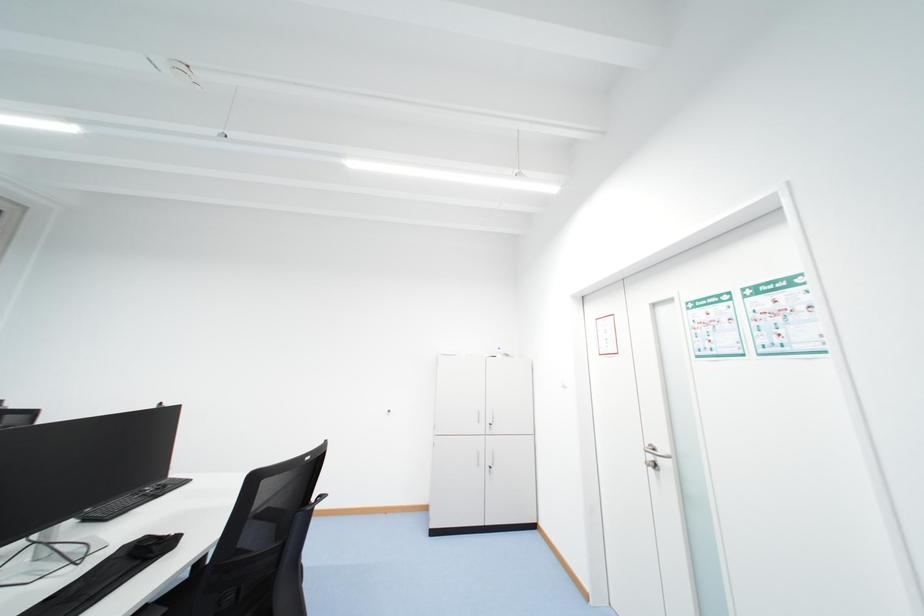
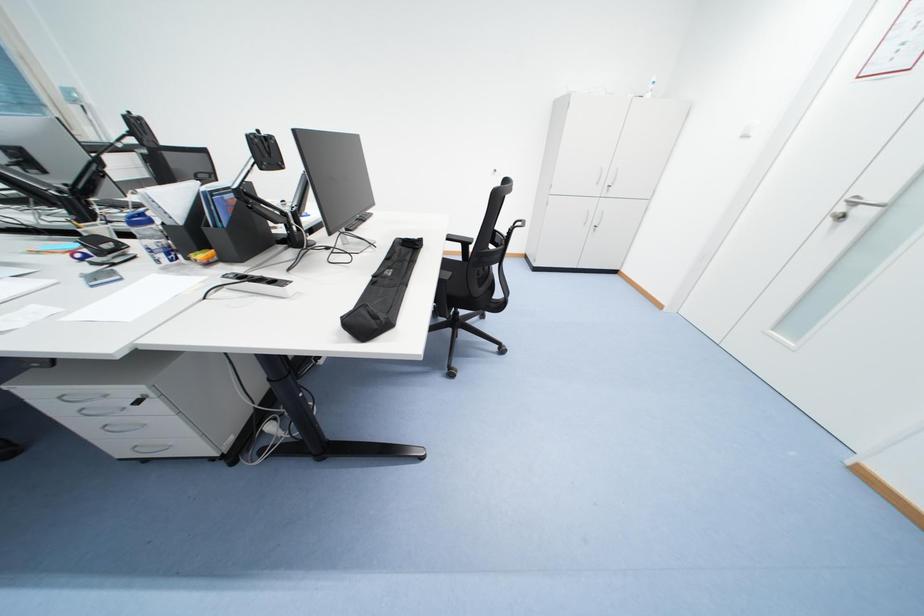
Question: The images are taken continuously from a first-person perspective. In which direction is your viewpoint rotating?

Choices:
 (A) Left
 (B) Right
 (C) Up
 (D) Down

Answer: (D)